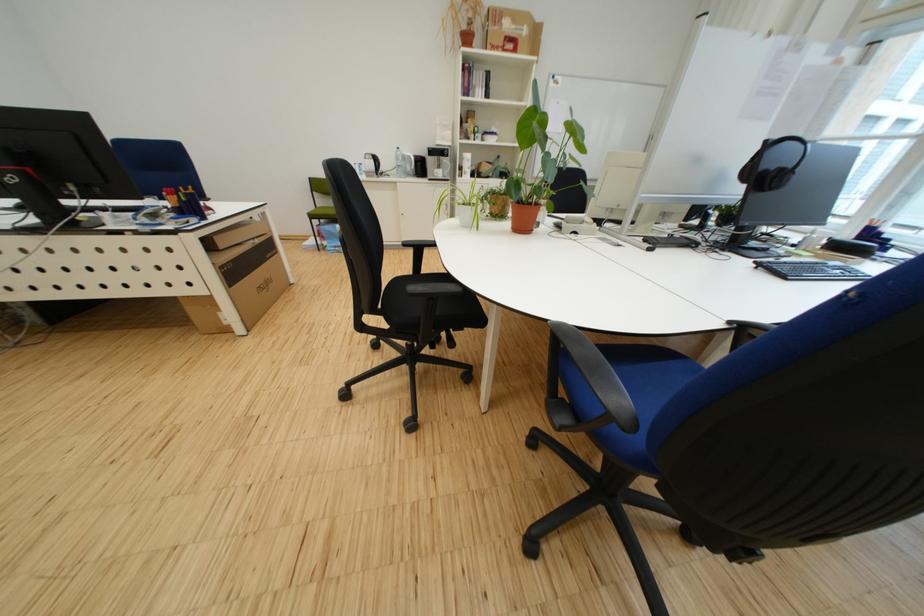
Find the location of a particular element. blue chair sitting surface is located at coordinates (666, 370).